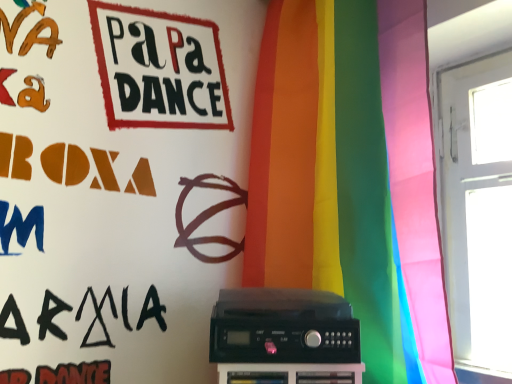
Question: Is rainbow fabric curtain at center positioned far away from black plastic amplifier at center?

Choices:
 (A) no
 (B) yes

Answer: (A)

Question: Is rainbow fabric curtain at center closer to the viewer compared to black plastic amplifier at center?

Choices:
 (A) yes
 (B) no

Answer: (A)

Question: Is rainbow fabric curtain at center bigger than black plastic amplifier at center?

Choices:
 (A) yes
 (B) no

Answer: (A)

Question: From the image's perspective, is rainbow fabric curtain at center beneath black plastic amplifier at center?

Choices:
 (A) yes
 (B) no

Answer: (B)

Question: Can you confirm if rainbow fabric curtain at center is thinner than black plastic amplifier at center?

Choices:
 (A) yes
 (B) no

Answer: (B)

Question: Is rainbow fabric curtain at center to the left of black plastic amplifier at center from the viewer's perspective?

Choices:
 (A) no
 (B) yes

Answer: (A)

Question: Is there a large distance between black plastic amplifier at center and rainbow fabric curtain at center?

Choices:
 (A) no
 (B) yes

Answer: (A)

Question: Considering the relative sizes of black plastic amplifier at center and rainbow fabric curtain at center in the image provided, is black plastic amplifier at center smaller than rainbow fabric curtain at center?

Choices:
 (A) no
 (B) yes

Answer: (B)

Question: Is black plastic amplifier at center oriented away from rainbow fabric curtain at center?

Choices:
 (A) no
 (B) yes

Answer: (B)

Question: Would you say black plastic amplifier at center contains rainbow fabric curtain at center?

Choices:
 (A) yes
 (B) no

Answer: (B)

Question: From a real-world perspective, is black plastic amplifier at center under rainbow fabric curtain at center?

Choices:
 (A) yes
 (B) no

Answer: (A)

Question: Is black plastic amplifier at center wider than rainbow fabric curtain at center?

Choices:
 (A) no
 (B) yes

Answer: (A)

Question: Looking at their shapes, would you say black plastic amplifier at center is wider or thinner than rainbow fabric curtain at center?

Choices:
 (A) thin
 (B) wide

Answer: (A)